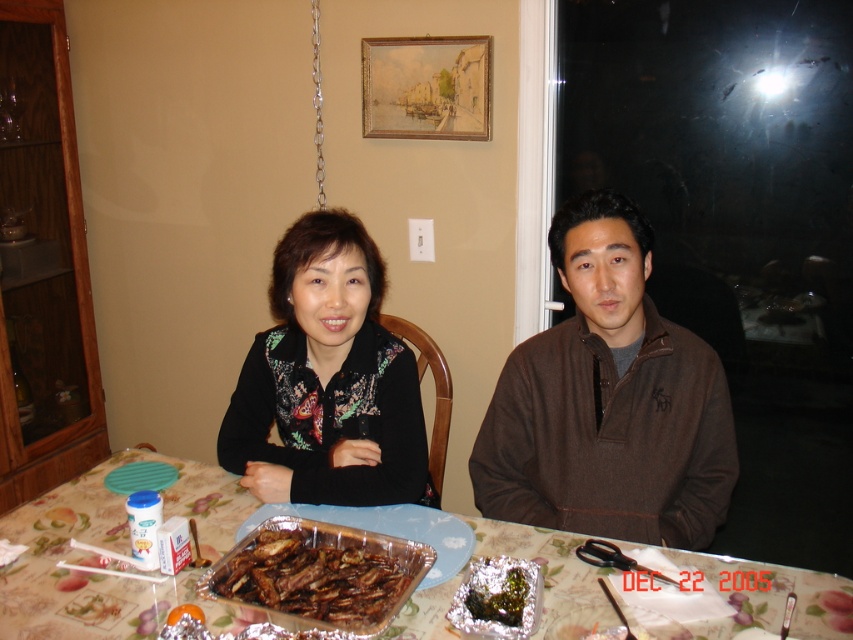
You are a guest at this dinner and need to place your brown fleece jacket somewhere. The host mentioned there is a designated spot marked by a point at coordinates (608, 401). Where should you put your brown fleece jacket at center?

The point at coordinates (608, 401) marks the location of the brown fleece jacket at center, so you should place your brown fleece jacket at center at that specific coordinate.

You are standing at the position of point (473,616) and want to move towards point (577,310). Is there any obstacle between you and your destination?

Point (577,310) is behind point (473,616), so there is no obstacle between you and your destination.

You are a guest at this dining table and want to reach for the brown glazed ribs at center. However, the patterned fabric tablecloth at center is covering it. Can you easily access the ribs without moving the tablecloth?

The patterned fabric tablecloth at center is positioned over brown glazed ribs at center, so the tablecloth is covering the ribs. To access the ribs, you would need to move the tablecloth first.